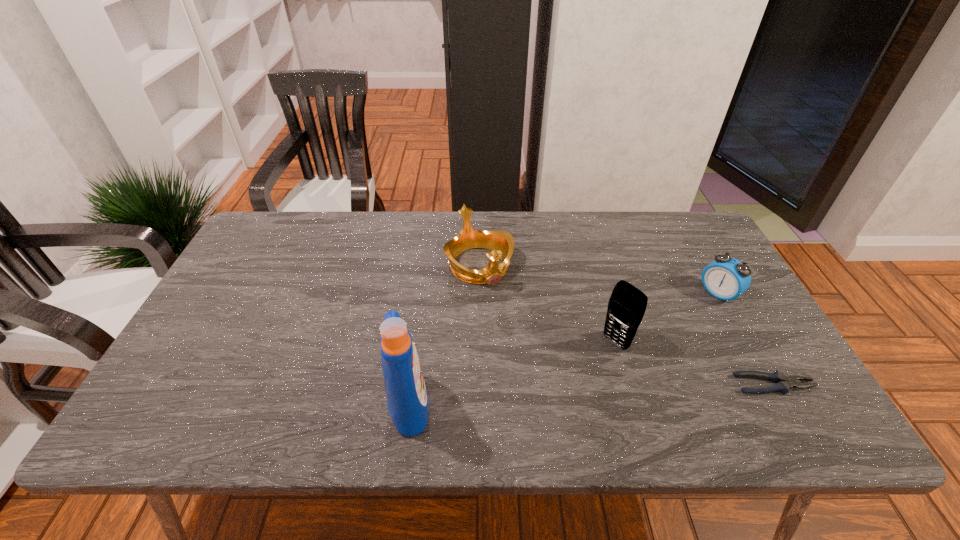
Identify the location of the tallest object. (407, 399).

Where is `the leftmost object`? This screenshot has height=540, width=960. the leftmost object is located at coordinates (407, 399).

Image resolution: width=960 pixels, height=540 pixels. I want to click on pliers, so click(x=783, y=383).

I want to click on tiara, so click(501, 243).

Where is `alarm clock`? alarm clock is located at coordinates (726, 278).

Identify the location of the third farthest object. (626, 307).

I want to click on the third object from right to left, so click(626, 307).

At what (x,y) coordinates should I click in order to perform the action: click on free space located 0.310m at the front emblem of the tiara. Please return your answer as a coordinate pair (x, y). This screenshot has width=960, height=540. Looking at the image, I should click on (545, 379).

This screenshot has height=540, width=960. I want to click on free space located at the front emblem of the tiara, so click(530, 353).

Locate an element on the screen. This screenshot has width=960, height=540. free space located at the front emblem of the tiara is located at coordinates (554, 393).